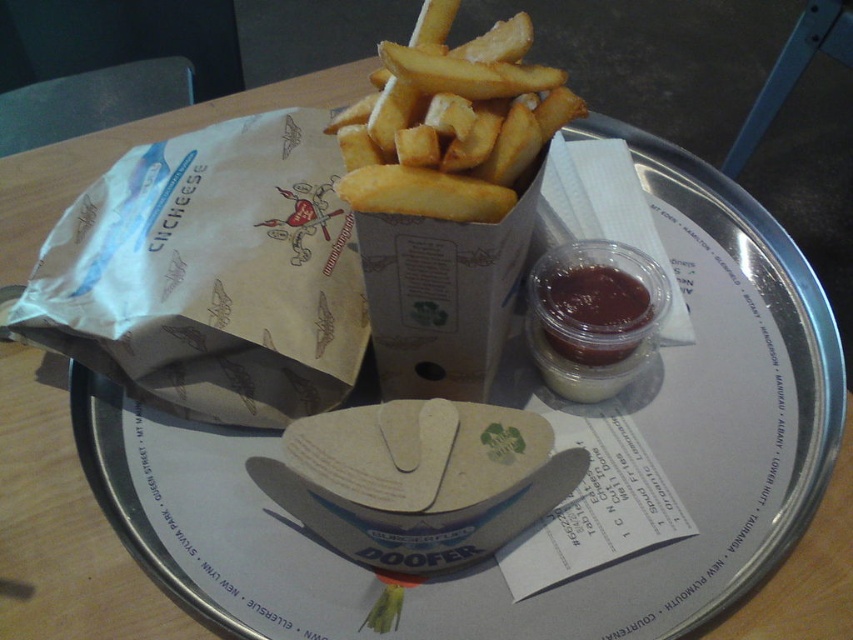
Can you confirm if golden crispy french fries at center is wider than shiny plastic cup of tomato sauce at center-right?

Yes, golden crispy french fries at center is wider than shiny plastic cup of tomato sauce at center-right.

Which is behind, point (473, 168) or point (648, 330)?

The point (648, 330) is more distant.

Where is `golden crispy french fries at center`? The image size is (853, 640). golden crispy french fries at center is located at coordinates (451, 122).